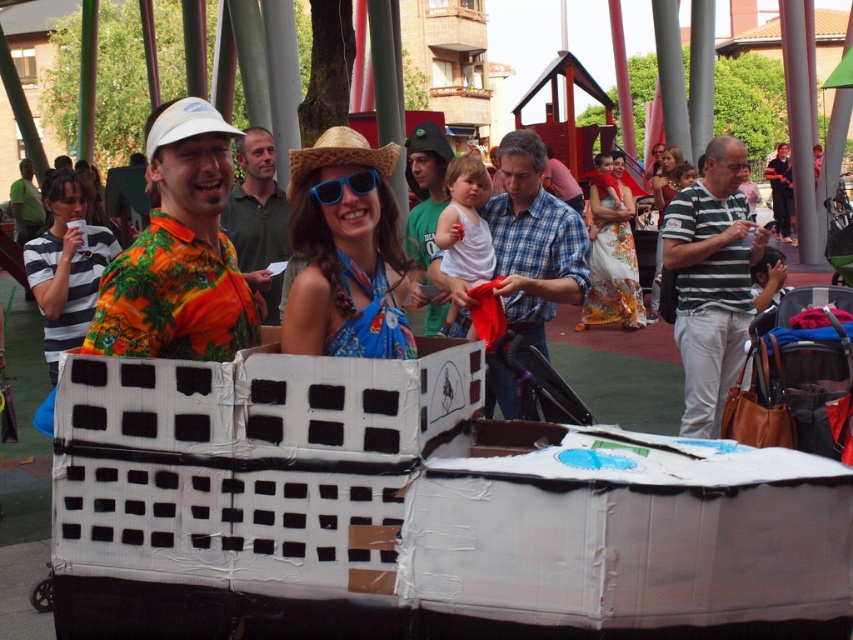
Question: Does hawaiian print shirt at center lie in front of striped fabric shirt at left?

Choices:
 (A) no
 (B) yes

Answer: (B)

Question: Which object is positioned farthest from the hawaiian print shirt at center?

Choices:
 (A) matte blue dress at center
 (B) blue fabric dress at center

Answer: (A)

Question: Can you confirm if blue fabric dress at center is positioned above green cotton shirt at center?

Choices:
 (A) no
 (B) yes

Answer: (A)

Question: Which of the following is the closest to the observer?

Choices:
 (A) blue plaid shirt at center
 (B) blue plastic goggles at center

Answer: (B)

Question: Which object appears closest to the camera in this image?

Choices:
 (A) orange floral shirt at center
 (B) matte blue dress at center
 (C) green cotton shirt at center

Answer: (A)

Question: Does striped fabric shirt at left appear over floral silk dress at center?

Choices:
 (A) no
 (B) yes

Answer: (A)